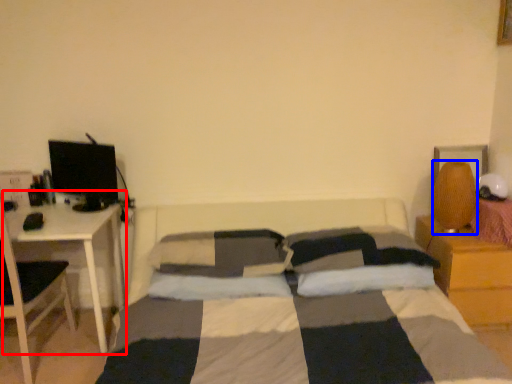
Question: Which object is closer to the camera taking this photo, table (highlighted by a red box) or table lamp (highlighted by a blue box)?

Choices:
 (A) table
 (B) table lamp

Answer: (A)